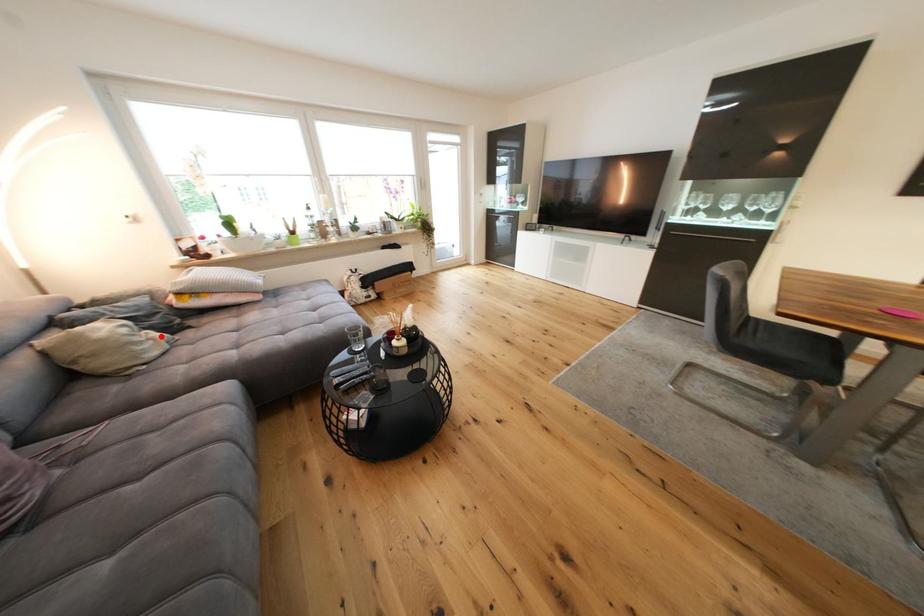
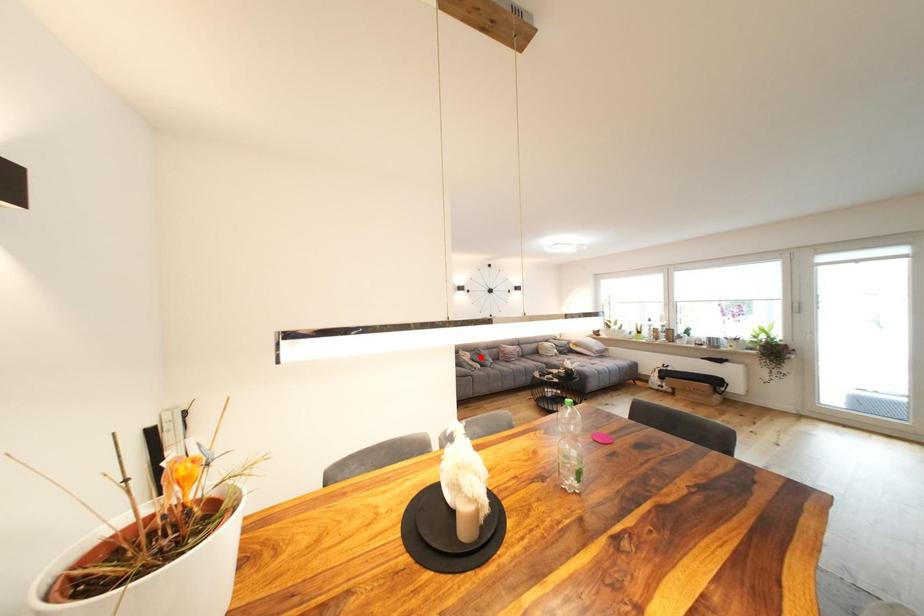
I am providing you with two images of the same scene from different viewpoints. A red point is marked on the first image and another point is marked on the second image. Are the points marked in image1 and image2 representing the same 3D position?

No